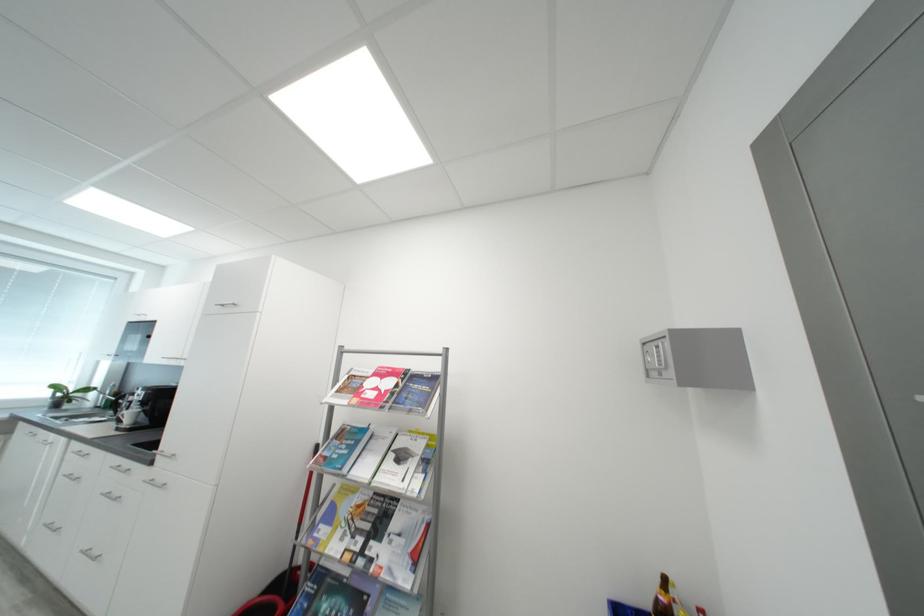
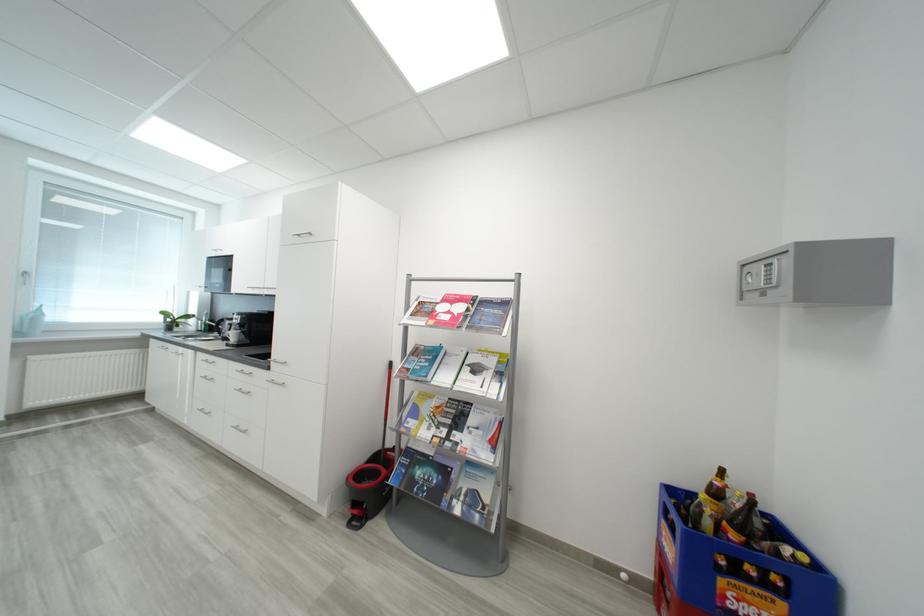
Question: Which direction would the cameraman need to move to produce the second image? Reply with the corresponding letter.

Choices:
 (A) Left
 (B) Right
 (C) Forward
 (D) Backward

Answer: (A)